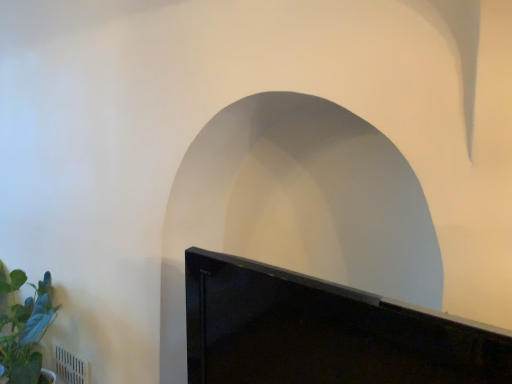
Find the location of `green matte leafy plant at lower left`. green matte leafy plant at lower left is located at coordinates (26, 335).

Describe the element at coordinates (26, 335) in the screenshot. I see `green matte leafy plant at lower left` at that location.

Find the location of a particular element. This screenshot has height=384, width=512. green matte leafy plant at lower left is located at coordinates (26, 335).